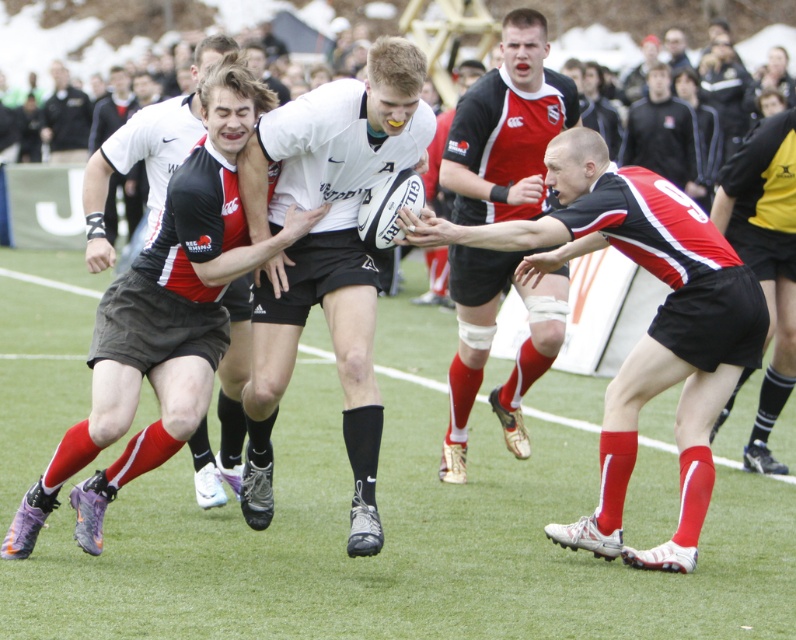
Does red and black jersey at center have a greater width compared to black jersey at center?

Correct, the width of red and black jersey at center exceeds that of black jersey at center.

You are a GUI agent. You are given a task and a screenshot of the screen. Output one action in this format:
    pyautogui.click(x=<x>, y=<y>)
    Task: Click on the red and black jersey at center
    This screenshot has height=640, width=796.
    Given the screenshot: What is the action you would take?
    pyautogui.click(x=650, y=324)

What do you see at coordinates (650, 324) in the screenshot? This screenshot has width=796, height=640. I see `red and black jersey at center` at bounding box center [650, 324].

The width and height of the screenshot is (796, 640). Identify the location of red and black jersey at center. pos(650,324).

Does matte black rugby ball at center have a smaller size compared to matte black shorts at center?

Incorrect, matte black rugby ball at center is not smaller in size than matte black shorts at center.

Which of these two, matte black rugby ball at center or matte black shorts at center, stands shorter?

With less height is matte black rugby ball at center.

I want to click on matte black rugby ball at center, so point(162,317).

Where is `matte black rugby ball at center`? This screenshot has width=796, height=640. matte black rugby ball at center is located at coordinates (162, 317).

Can you confirm if green artificial turf at center is taller than dark gray uniform at upper left?

Indeed, green artificial turf at center has a greater height compared to dark gray uniform at upper left.

Which of these two, green artificial turf at center or dark gray uniform at upper left, stands taller?

Standing taller between the two is green artificial turf at center.

Does point (256, 532) come behind point (49, 106)?

No, (256, 532) is in front of (49, 106).

The height and width of the screenshot is (640, 796). Identify the location of green artificial turf at center. (398, 541).